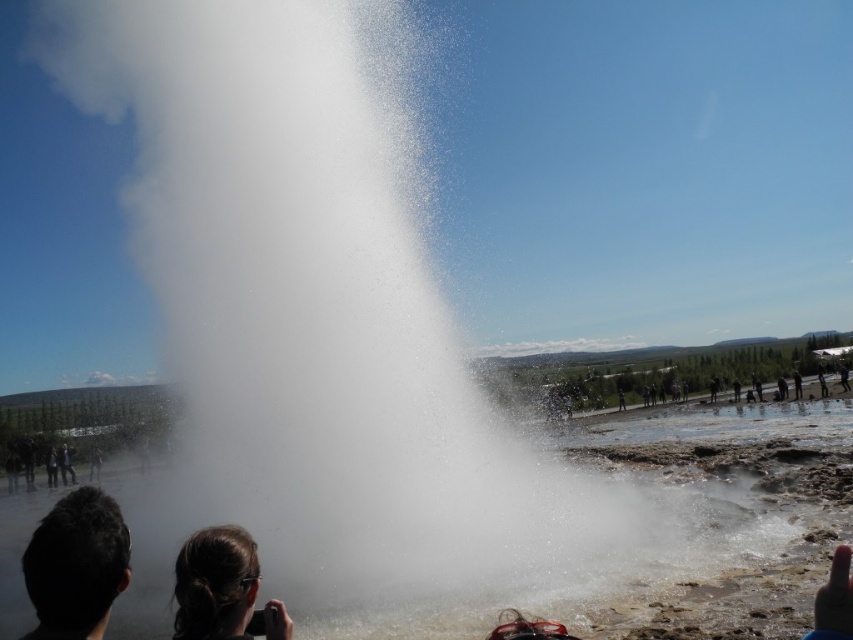
You are a photographer standing at the center of the geothermal area, wanting to capture a photo of the dark brown hair at lower left and dark brown leather jacket at lower left in the same frame. Given that your camera has a maximum zoom range of 100 meters, can you fit both subjects into the photo without moving closer?

The dark brown hair at lower left and dark brown leather jacket at lower left are 37.96 meters apart. Since your camera has a maximum zoom range of 100 meters, which is greater than the distance between them, you can fit both subjects into the photo without moving closer.